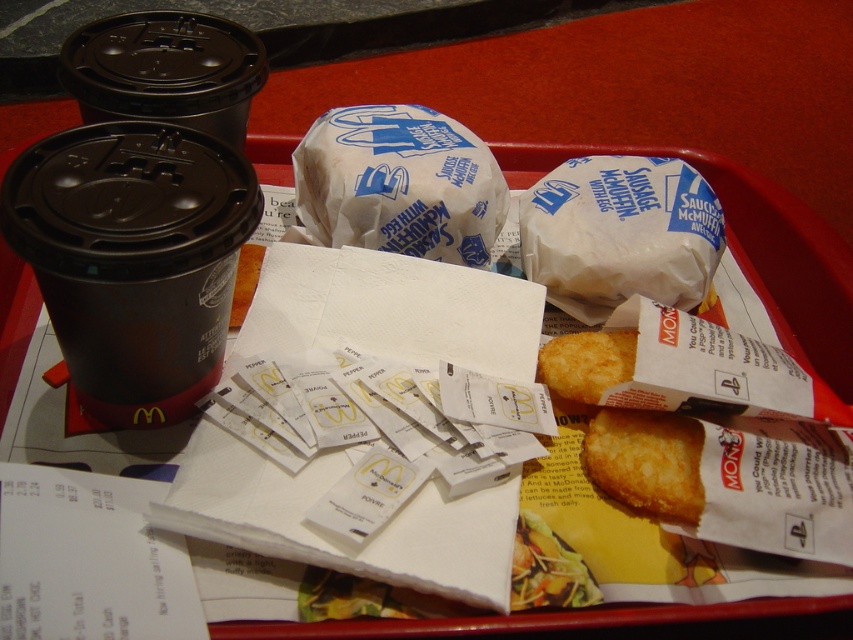
You are a McDonalds employee arranging items on a tray. You have a black paper cup at left and a white paper wrapped sausage muffin at center. According to the image, which item is positioned to the right of the other?

The white paper wrapped sausage muffin at center is to the right of the black paper cup at left.